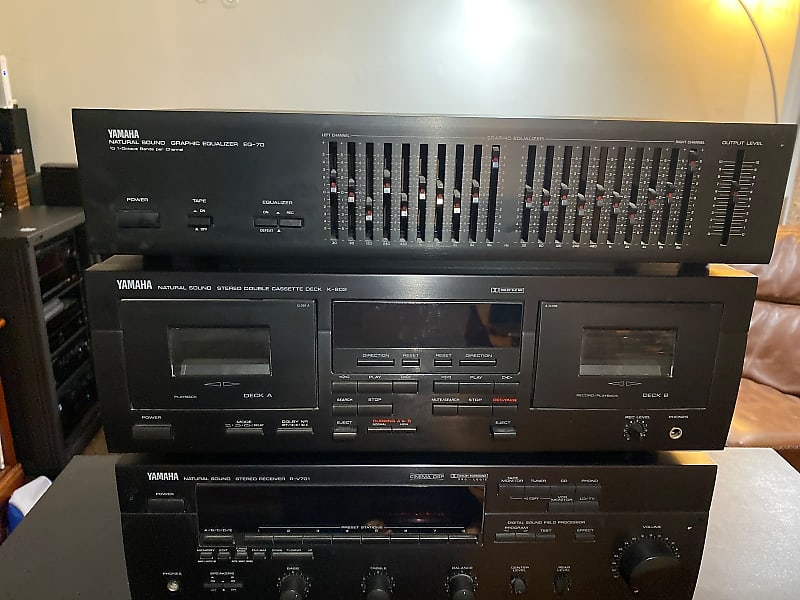
Locate an element on the screen. Image resolution: width=800 pixels, height=600 pixels. tape player is located at coordinates (218, 374), (622, 409).